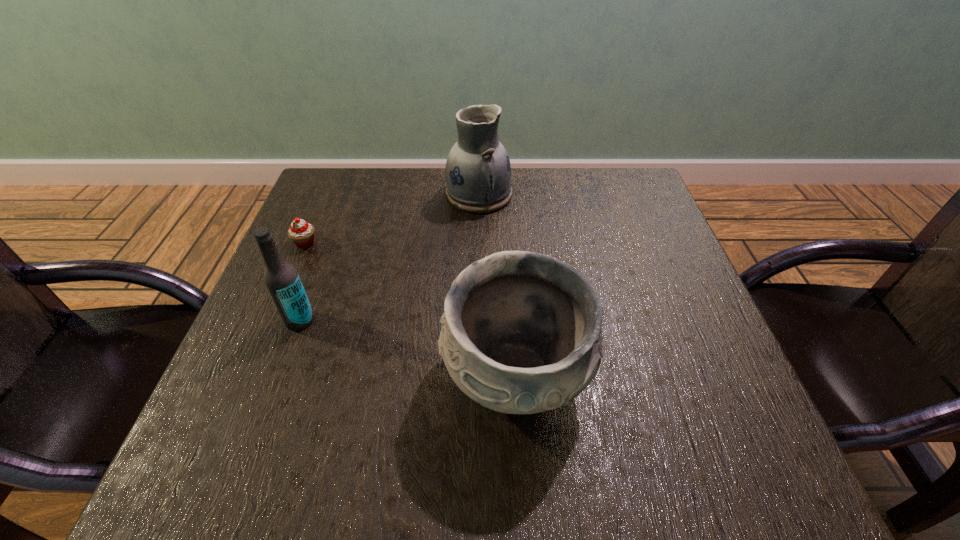
Identify which object is the second nearest to the taller pottery. Please provide its 2D coordinates. Your answer should be formatted as a tuple, i.e. [(x, y)], where the tuple contains the x and y coordinates of a point satisfying the conditions above.

[(521, 333)]

Find the location of `blank space that satisfies the following two spatial constraints: 1. on the front side of the shortest object; 2. on the left side of the second shortest object`. blank space that satisfies the following two spatial constraints: 1. on the front side of the shortest object; 2. on the left side of the second shortest object is located at coordinates (249, 375).

You are a GUI agent. You are given a task and a screenshot of the screen. Output one action in this format:
    pyautogui.click(x=<x>, y=<y>)
    Task: Click on the vacant space that satisfies the following two spatial constraints: 1. on the side of the beer bottle with the label; 2. on the left side of the shorter pottery
    
    Given the screenshot: What is the action you would take?
    pyautogui.click(x=279, y=375)

Locate an element on the screen. The height and width of the screenshot is (540, 960). vacant point that satisfies the following two spatial constraints: 1. on the back side of the taller pottery; 2. on the right side of the cupcake is located at coordinates (326, 194).

Identify the location of vacant space that satisfies the following two spatial constraints: 1. on the side of the shorter pottery with the label; 2. on the right side of the beer bottle. Image resolution: width=960 pixels, height=540 pixels. (279, 375).

You are a GUI agent. You are given a task and a screenshot of the screen. Output one action in this format:
    pyautogui.click(x=<x>, y=<y>)
    Task: Click on the vacant region that satisfies the following two spatial constraints: 1. on the side of the beer bottle with the label; 2. on the left side of the third tallest object
    
    Given the screenshot: What is the action you would take?
    pyautogui.click(x=279, y=375)

Image resolution: width=960 pixels, height=540 pixels. I want to click on free region that satisfies the following two spatial constraints: 1. on the side of the beer bottle with the label; 2. on the right side of the second shortest object, so click(x=279, y=375).

This screenshot has width=960, height=540. Identify the location of vacant position in the image that satisfies the following two spatial constraints: 1. on the side of the beer bottle with the label; 2. on the right side of the second shortest object. (279, 375).